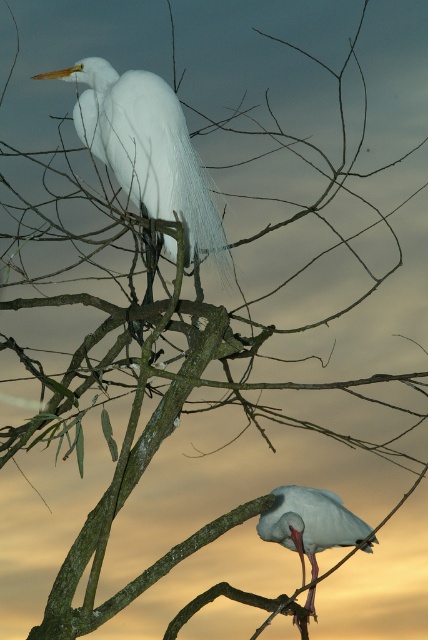
Can you confirm if matte white egret at upper center is positioned below white matte bird at lower right?

No, matte white egret at upper center is not below white matte bird at lower right.

Can you confirm if matte white egret at upper center is bigger than white matte bird at lower right?

Yes, matte white egret at upper center is bigger than white matte bird at lower right.

This screenshot has height=640, width=428. Describe the element at coordinates (146, 148) in the screenshot. I see `matte white egret at upper center` at that location.

At what (x,y) coordinates should I click in order to perform the action: click on matte white egret at upper center. Please return your answer as a coordinate pair (x, y). Image resolution: width=428 pixels, height=640 pixels. Looking at the image, I should click on (146, 148).